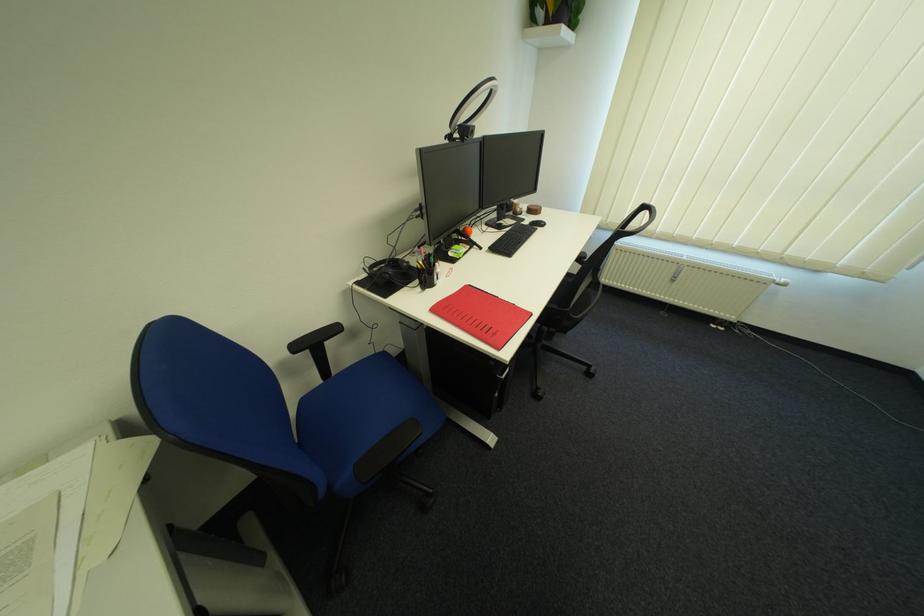
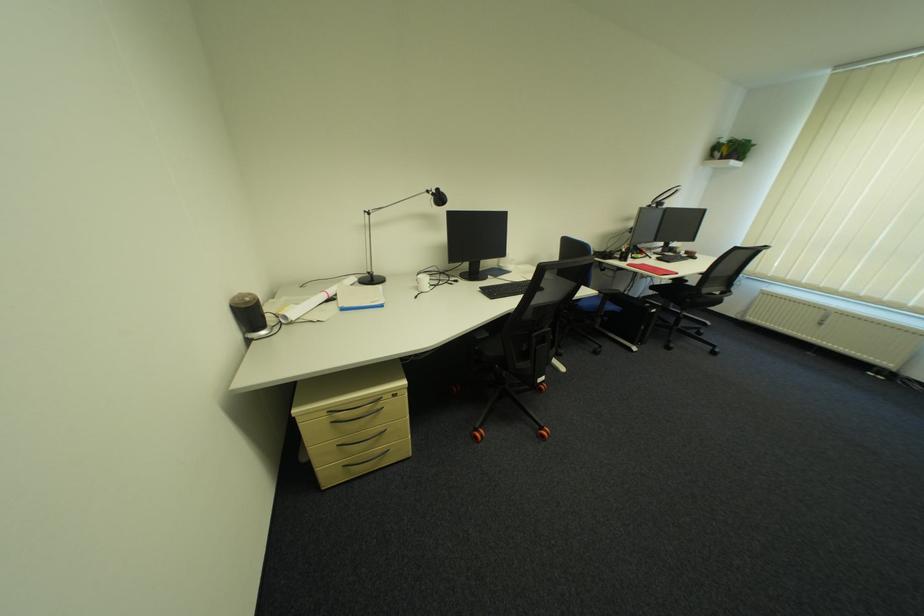
Where in the second image is the point corresponding to [528,209] from the first image?

(687, 252)